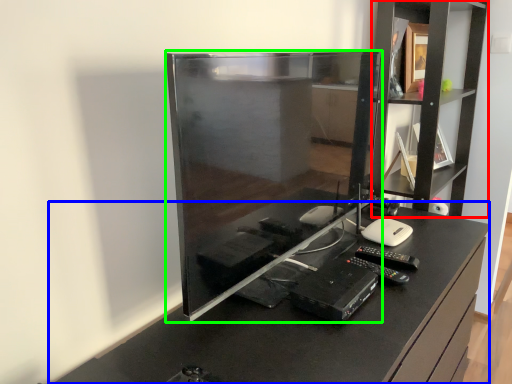
Question: Which object is the closest to the shelf (highlighted by a red box)? Choose among these: furniture (highlighted by a blue box) or desktop computer (highlighted by a green box).

Choices:
 (A) furniture
 (B) desktop computer

Answer: (A)